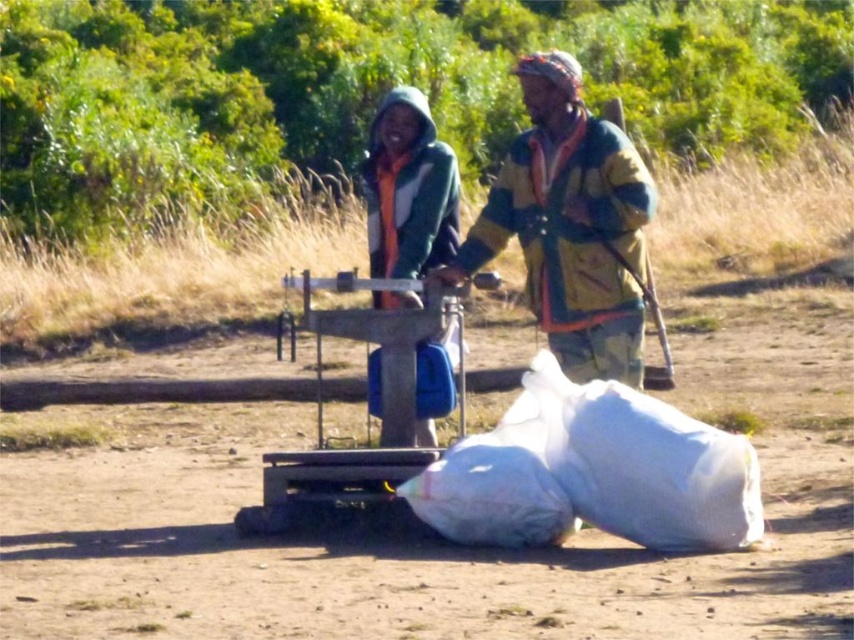
You are a delivery drone that needs to drop off a package between the multicolored fabric jacket at center and the green fuzzy jacket at center. The minimum distance required for safe landing is 10 feet. Can you safely land there?

The multicolored fabric jacket at center and green fuzzy jacket at center are 8.78 feet apart from each other, which is less than the required 10 feet for safe landing. Therefore, you cannot safely land between them.

In the scene shown: You are a delivery person who needs to pack a fragile item. Which container between the white plastic sack at lower right and the multicolored fabric jacket at center would be more suitable for protecting the item?

The white plastic sack at lower right has a larger size compared to the multicolored fabric jacket at center, so it would be more suitable for protecting the fragile item as it can accommodate the item better.